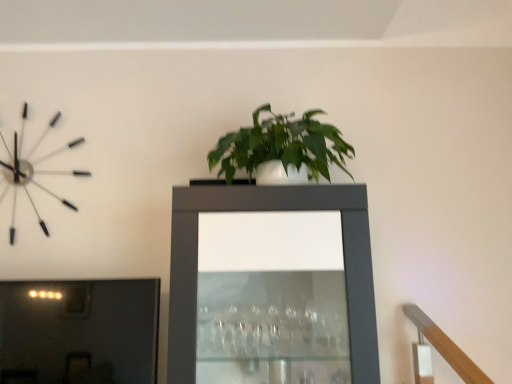
Question: Should I look upward or downward to see matte black cabinet at center?

Choices:
 (A) down
 (B) up

Answer: (A)

Question: Should I look upward or downward to see metallic silver clock at upper left?

Choices:
 (A) up
 (B) down

Answer: (A)

Question: Is metallic silver clock at upper left positioned with its back to matte black cabinet at center?

Choices:
 (A) yes
 (B) no

Answer: (B)

Question: Is metallic silver clock at upper left outside of matte black cabinet at center?

Choices:
 (A) yes
 (B) no

Answer: (A)

Question: From the image's perspective, is metallic silver clock at upper left beneath matte black cabinet at center?

Choices:
 (A) no
 (B) yes

Answer: (A)

Question: Is metallic silver clock at upper left to the right of matte black cabinet at center from the viewer's perspective?

Choices:
 (A) yes
 (B) no

Answer: (B)

Question: From a real-world perspective, is metallic silver clock at upper left positioned over matte black cabinet at center based on gravity?

Choices:
 (A) no
 (B) yes

Answer: (B)

Question: Can you confirm if metallic silver clock at upper left is bigger than matte black cabinet at center?

Choices:
 (A) yes
 (B) no

Answer: (B)

Question: From the image's perspective, is matte black cabinet at center located above metallic silver clock at upper left?

Choices:
 (A) no
 (B) yes

Answer: (A)

Question: Can you confirm if matte black cabinet at center is bigger than metallic silver clock at upper left?

Choices:
 (A) yes
 (B) no

Answer: (A)

Question: Is metallic silver clock at upper left at the back of matte black cabinet at center?

Choices:
 (A) no
 (B) yes

Answer: (A)

Question: Is matte black cabinet at center with metallic silver clock at upper left?

Choices:
 (A) no
 (B) yes

Answer: (A)

Question: Does matte black cabinet at center appear on the right side of metallic silver clock at upper left?

Choices:
 (A) yes
 (B) no

Answer: (A)

Question: From the image's perspective, is matte black cabinet at center beneath metallic silver clock at upper left?

Choices:
 (A) yes
 (B) no

Answer: (A)

Question: Is matte black cabinet at center bigger or smaller than metallic silver clock at upper left?

Choices:
 (A) small
 (B) big

Answer: (B)